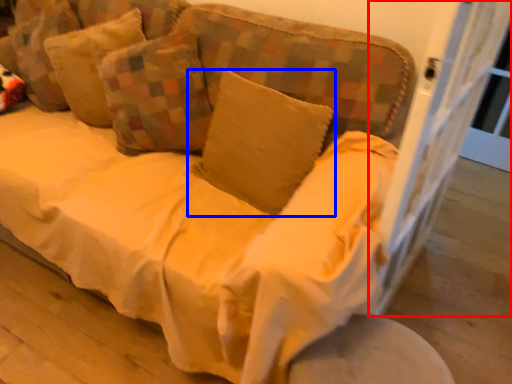
Question: Which object is further to the camera taking this photo, screen door (highlighted by a red box) or pillow (highlighted by a blue box)?

Choices:
 (A) screen door
 (B) pillow

Answer: (B)